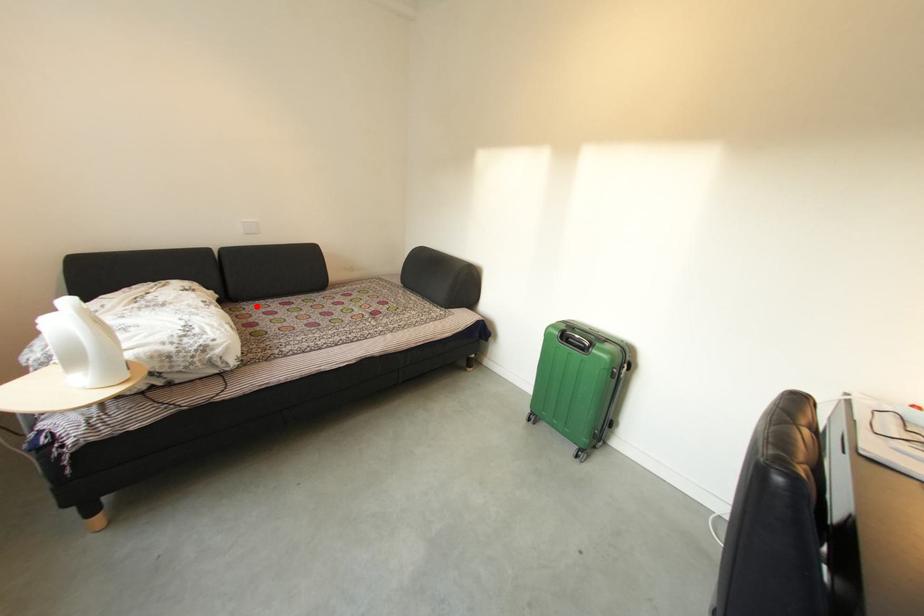
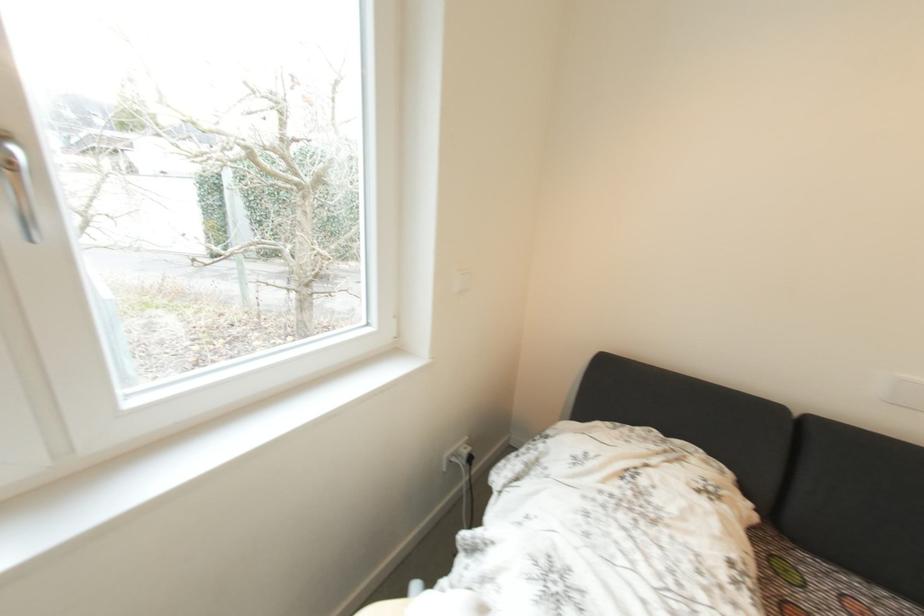
Where in the second image is the point corresponding to the highlighted location from the first image?

(820, 561)